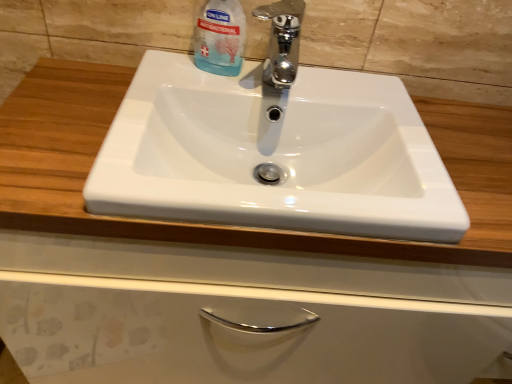
Question: Should I look upward or downward to see white glossy sink at center?

Choices:
 (A) up
 (B) down

Answer: (A)

Question: From the image's perspective, is chrome metallic faucet at center on white glossy sink at center?

Choices:
 (A) yes
 (B) no

Answer: (A)

Question: Is the depth of chrome metallic faucet at center greater than that of white glossy sink at center?

Choices:
 (A) no
 (B) yes

Answer: (B)

Question: Is chrome metallic faucet at center positioned beyond the bounds of white glossy sink at center?

Choices:
 (A) no
 (B) yes

Answer: (B)

Question: Considering the relative sizes of chrome metallic faucet at center and white glossy sink at center in the image provided, is chrome metallic faucet at center taller than white glossy sink at center?

Choices:
 (A) no
 (B) yes

Answer: (B)

Question: From a real-world perspective, does chrome metallic faucet at center stand above white glossy sink at center?

Choices:
 (A) no
 (B) yes

Answer: (B)

Question: Considering the relative sizes of chrome metallic faucet at center and white glossy sink at center in the image provided, is chrome metallic faucet at center thinner than white glossy sink at center?

Choices:
 (A) yes
 (B) no

Answer: (A)

Question: Are white glossy sink at center and chrome metallic faucet at center beside each other?

Choices:
 (A) no
 (B) yes

Answer: (A)

Question: From the image's perspective, is white glossy sink at center above chrome metallic faucet at center?

Choices:
 (A) no
 (B) yes

Answer: (A)

Question: Is white glossy sink at center bigger than chrome metallic faucet at center?

Choices:
 (A) no
 (B) yes

Answer: (B)

Question: Is white glossy sink at center wider than chrome metallic faucet at center?

Choices:
 (A) yes
 (B) no

Answer: (A)

Question: From a real-world perspective, does white glossy sink at center sit lower than chrome metallic faucet at center?

Choices:
 (A) yes
 (B) no

Answer: (A)

Question: Is chrome metallic faucet at center completely or partially inside white glossy sink at center?

Choices:
 (A) no
 (B) yes

Answer: (A)

Question: Considering the relative sizes of chrome metallic faucet at center and transparent plastic bottle at upper center in the image provided, is chrome metallic faucet at center wider than transparent plastic bottle at upper center?

Choices:
 (A) no
 (B) yes

Answer: (B)